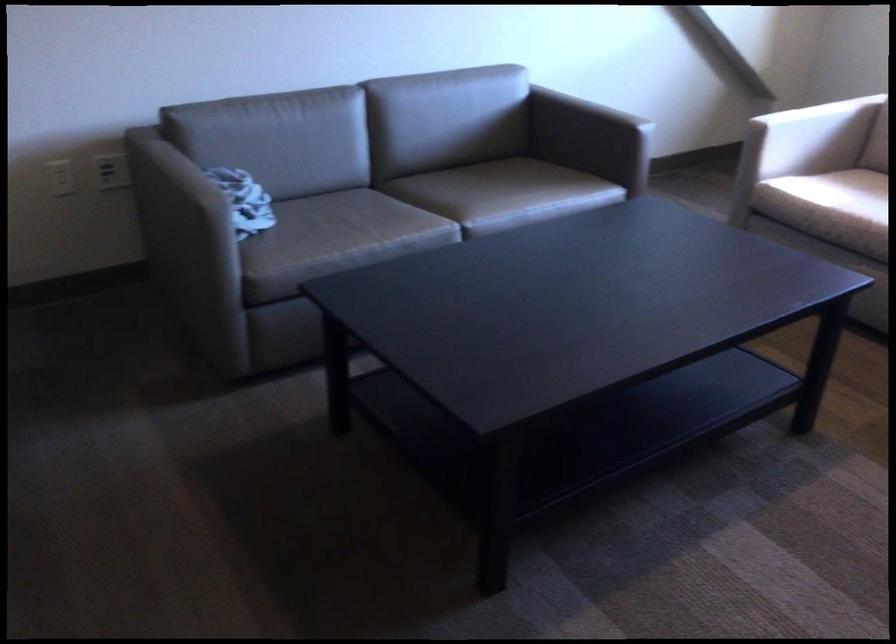
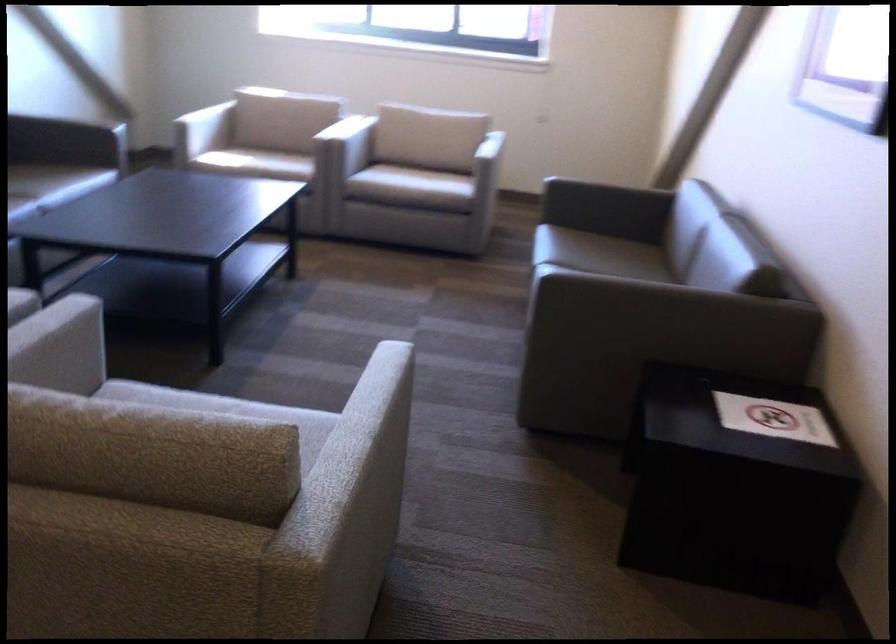
The point at (807, 154) is marked in the first image. Where is the corresponding point in the second image?

(202, 131)